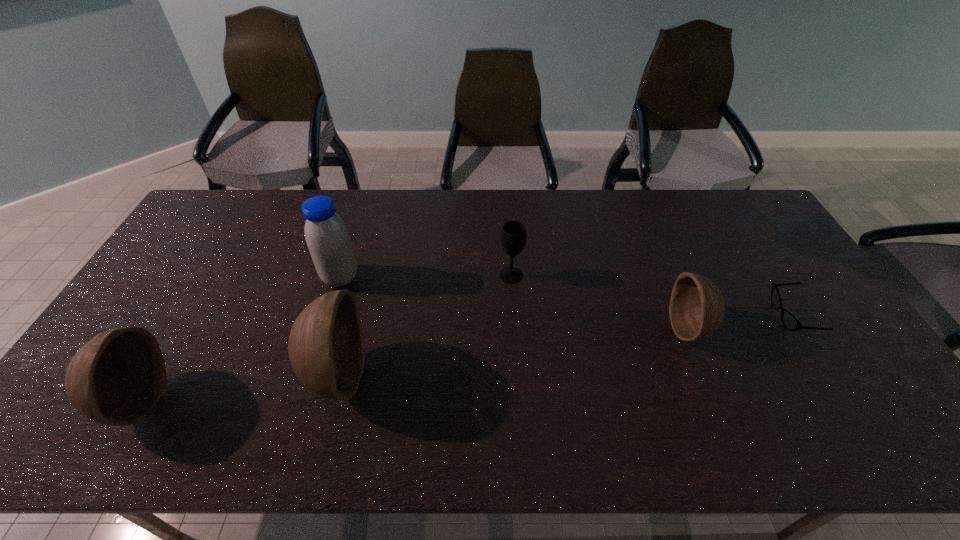
You are a GUI agent. You are given a task and a screenshot of the screen. Output one action in this format:
    pyautogui.click(x=<x>, y=<y>)
    Task: Click on the blank space that satisfies the following two spatial constraints: 1. on the back side of the second bowl from right to left; 2. on the right side of the rightmost bowl
    The image size is (960, 540).
    Given the screenshot: What is the action you would take?
    pyautogui.click(x=349, y=329)

Find the location of a particular element. The image size is (960, 540). vacant space that satisfies the following two spatial constraints: 1. on the back side of the leftmost bowl; 2. on the right side of the second bowl from left to right is located at coordinates (153, 374).